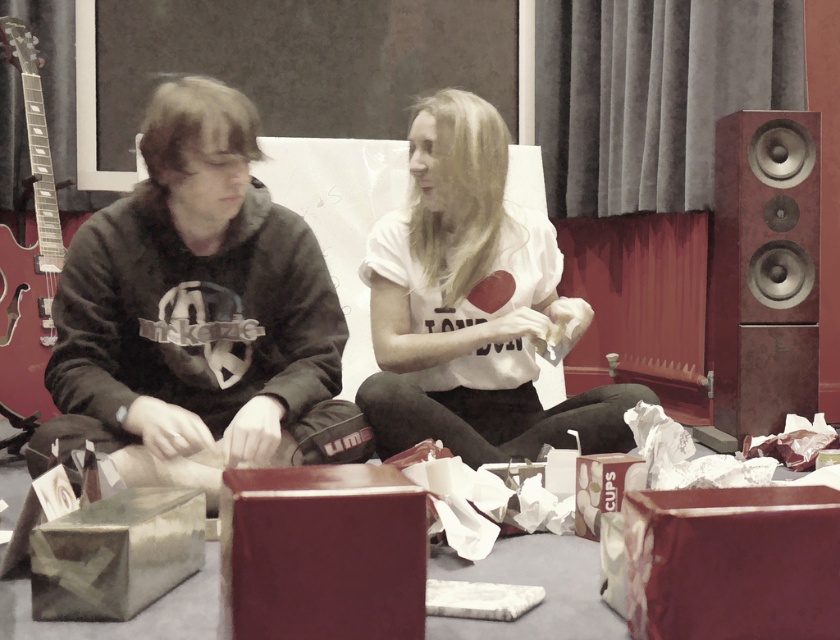
Question: Is white matte t-shirt at center to the left of shiny maroon box at lower right from the viewer's perspective?

Choices:
 (A) no
 (B) yes

Answer: (B)

Question: Where is dark gray hoodie at left located in relation to matte burgundy box at center in the image?

Choices:
 (A) left
 (B) right

Answer: (A)

Question: Is wooden/maroon speaker at right bigger than metallic silver box at lower left?

Choices:
 (A) yes
 (B) no

Answer: (A)

Question: Estimate the real-world distances between objects in this image. Which object is closer to the metallic silver box at lower left?

Choices:
 (A) dark gray hoodie at left
 (B) wooden/maroon speaker at right
 (C) shiny maroon box at lower right

Answer: (A)

Question: Which of the following is the farthest from the observer?

Choices:
 (A) (171, 184)
 (B) (84, 611)
 (C) (374, 618)
 (D) (586, 323)

Answer: (D)

Question: Which of these objects is positioned farthest from the white matte t-shirt at center?

Choices:
 (A) matte burgundy box at center
 (B) metallic silver box at lower left
 (C) shiny maroon box at lower right

Answer: (C)